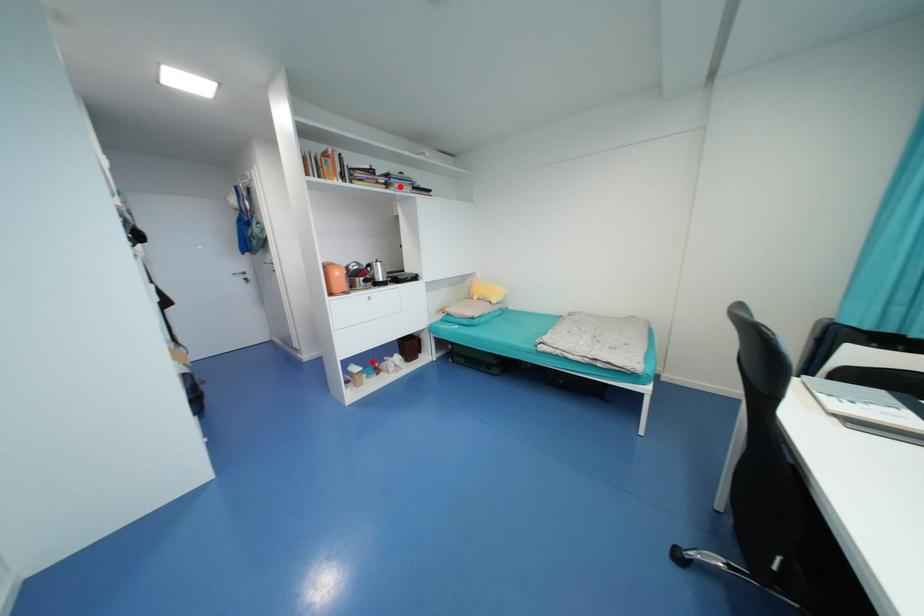
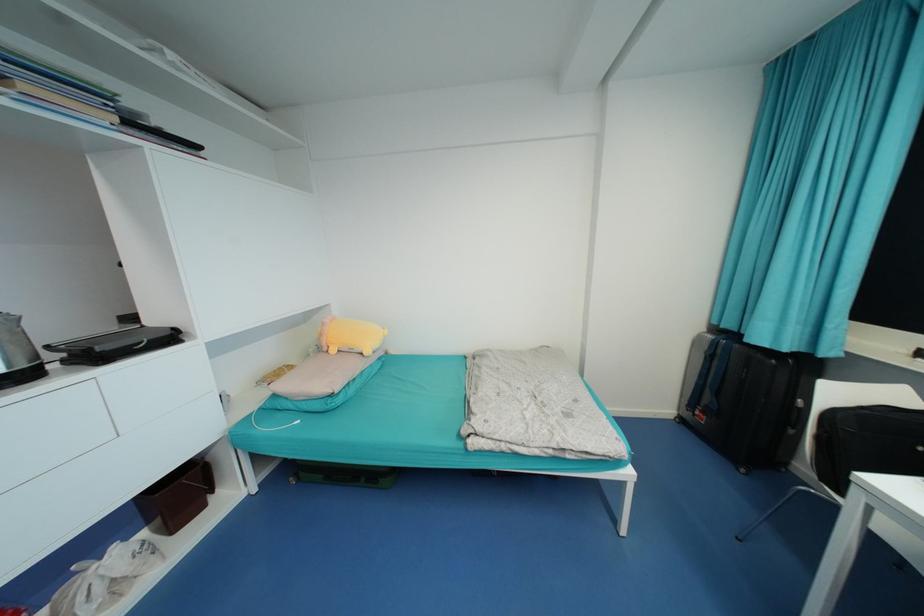
Find the pixel in the second image that matches the highlighted location in the first image.

(28, 87)